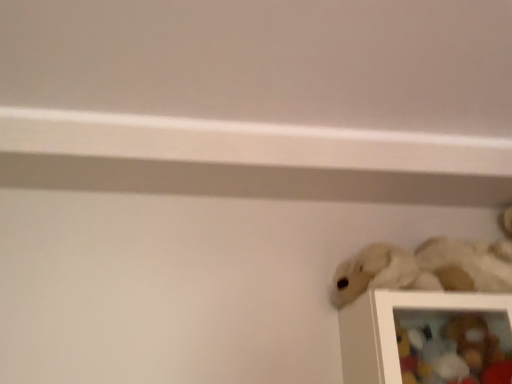
Question: Is fuzzy white stuffed animal at lower right, the 3th toy from the bottom, closer to camera compared to soft plush toy at lower right, which appears as the third toy when viewed from the top?

Choices:
 (A) no
 (B) yes

Answer: (B)

Question: Is soft plush toy at lower right, the first toy when ordered from bottom to top, at the back of fuzzy white stuffed animal at lower right, the 3th toy from the bottom?

Choices:
 (A) no
 (B) yes

Answer: (A)

Question: Does fuzzy white stuffed animal at lower right, acting as the first toy starting from the top, have a lesser width compared to soft plush toy at lower right, the first toy when ordered from bottom to top?

Choices:
 (A) no
 (B) yes

Answer: (A)

Question: Is fuzzy white stuffed animal at lower right, acting as the first toy starting from the top, not near soft plush toy at lower right, the first toy when ordered from bottom to top?

Choices:
 (A) no
 (B) yes

Answer: (A)

Question: Can you confirm if fuzzy white stuffed animal at lower right, the 3th toy from the bottom, is bigger than soft plush toy at lower right, the first toy when ordered from bottom to top?

Choices:
 (A) yes
 (B) no

Answer: (A)

Question: Considering the positions of fuzzy white stuffed animal at lower right, acting as the first toy starting from the top, and soft plush toy at lower right, which appears as the third toy when viewed from the top, in the image, is fuzzy white stuffed animal at lower right, acting as the first toy starting from the top, bigger or smaller than soft plush toy at lower right, which appears as the third toy when viewed from the top,?

Choices:
 (A) small
 (B) big

Answer: (B)

Question: Does point (496, 244) appear closer or farther from the camera than point (460, 326)?

Choices:
 (A) closer
 (B) farther

Answer: (B)

Question: Visually, is fuzzy white stuffed animal at lower right, acting as the first toy starting from the top, positioned to the left or to the right of soft plush toy at lower right, the first toy when ordered from bottom to top?

Choices:
 (A) left
 (B) right

Answer: (A)

Question: From the image's perspective, is fuzzy white stuffed animal at lower right, acting as the first toy starting from the top, located above or below soft plush toy at lower right, the first toy when ordered from bottom to top?

Choices:
 (A) below
 (B) above

Answer: (B)

Question: Relative to fuzzy white stuffed animal at lower right, acting as the first toy starting from the top, is soft plush toy at lower right, which appears as the third toy when viewed from the top, in front or behind?

Choices:
 (A) behind
 (B) front

Answer: (A)

Question: Is soft plush toy at lower right, which appears as the third toy when viewed from the top, bigger or smaller than fuzzy white stuffed animal at lower right, the 3th toy from the bottom?

Choices:
 (A) big
 (B) small

Answer: (B)

Question: From the image's perspective, is soft plush toy at lower right, which appears as the third toy when viewed from the top, above or below fuzzy white stuffed animal at lower right, acting as the first toy starting from the top?

Choices:
 (A) below
 (B) above

Answer: (A)

Question: Visually, is soft plush toy at lower right, the first toy when ordered from bottom to top, positioned to the left or to the right of fuzzy white stuffed animal at lower right, the 3th toy from the bottom?

Choices:
 (A) right
 (B) left

Answer: (A)

Question: Do you think soft plush toy at lower right, the first toy when ordered from bottom to top, is within white plush toy at lower right, placed as the 2th toy when sorted from bottom to top, or outside of it?

Choices:
 (A) inside
 (B) outside

Answer: (B)

Question: From the image's perspective, is soft plush toy at lower right, the first toy when ordered from bottom to top, positioned above or below white plush toy at lower right, which is the 2th toy in top-to-bottom order?

Choices:
 (A) below
 (B) above

Answer: (A)